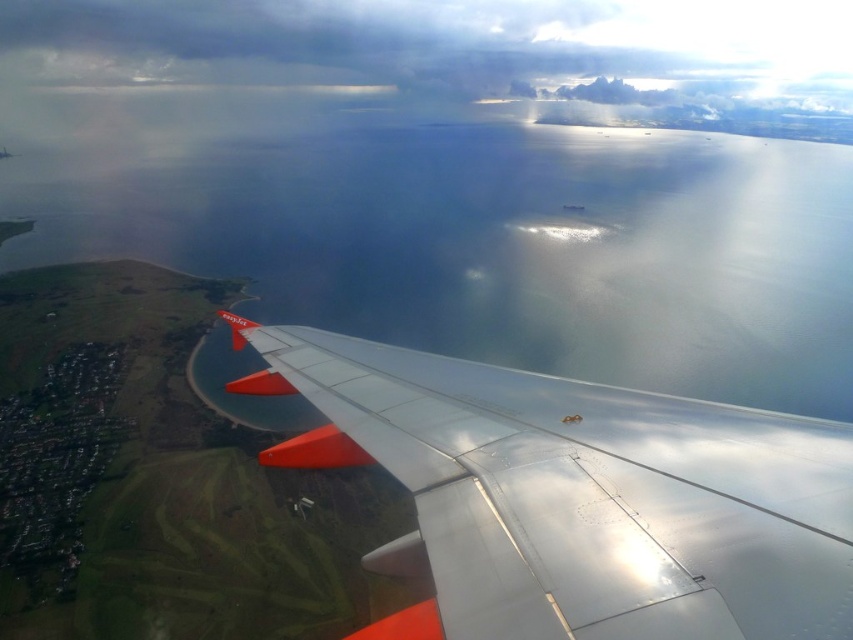
You are a passenger sitting in an aisle seat on the airplane. You notice a point marked at coordinates [577,497] on the window. Based on the scene described, what object is located at that point?

The point at coordinates [577,497] marks the metallic silver wing at lower right.